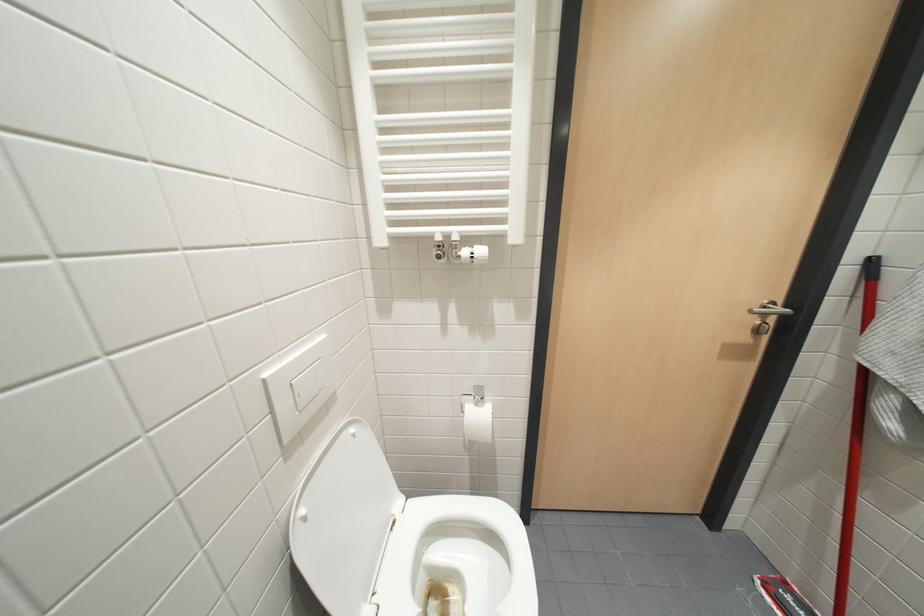
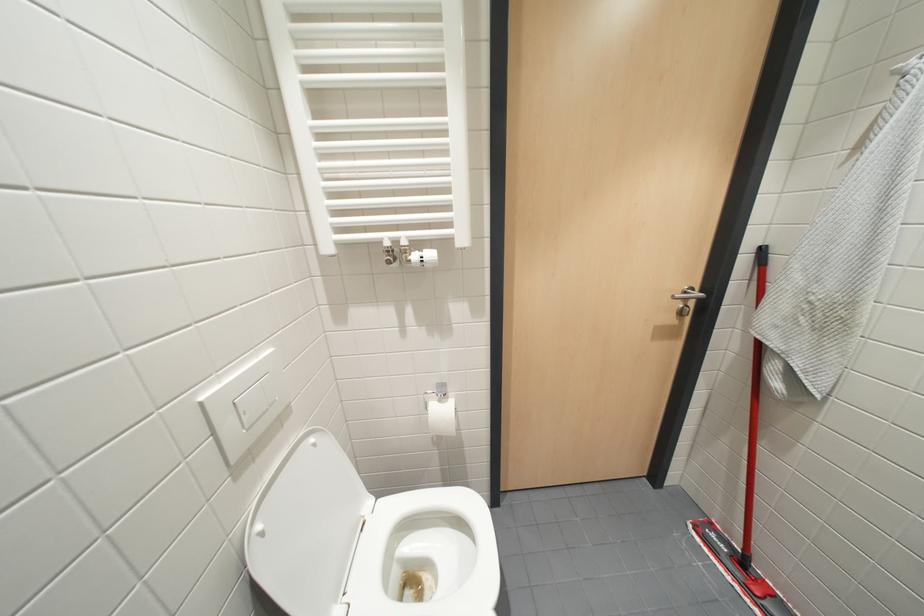
Question: How did the camera likely rotate?

Choices:
 (A) Left
 (B) Right
 (C) Up
 (D) Down

Answer: (B)